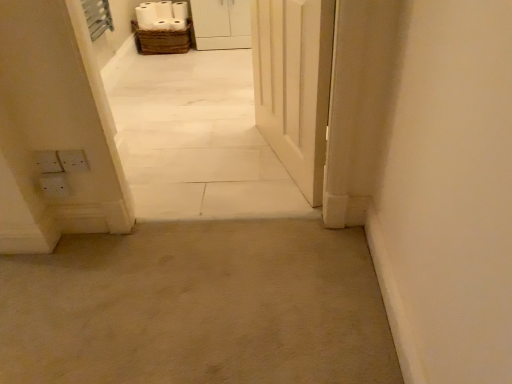
This screenshot has width=512, height=384. Describe the element at coordinates (294, 84) in the screenshot. I see `white matte door at center` at that location.

The width and height of the screenshot is (512, 384). Find the location of `white matte door at center`. white matte door at center is located at coordinates (294, 84).

I want to click on white matte door at center, so click(294, 84).